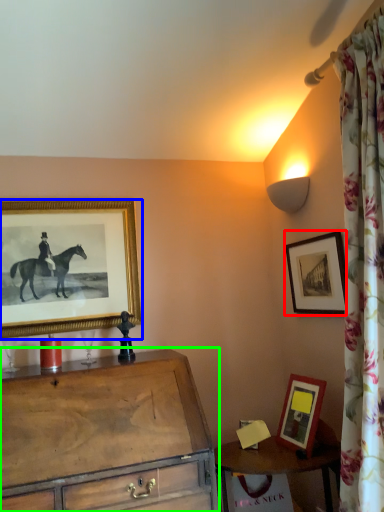
Question: Estimate the real-world distances between objects in this image. Which object is closer to picture frame (highlighted by a red box), picture frame (highlighted by a blue box) or chest of drawers (highlighted by a green box)?

Choices:
 (A) picture frame
 (B) chest of drawers

Answer: (B)